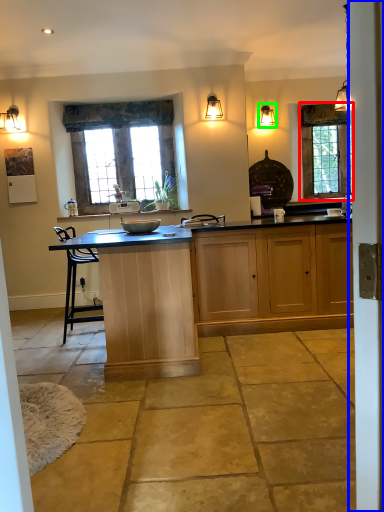
Question: Which object is positioned closest to window (highlighted by a red box)? Select from screen door (highlighted by a blue box) and lamp (highlighted by a green box).

Choices:
 (A) screen door
 (B) lamp

Answer: (B)